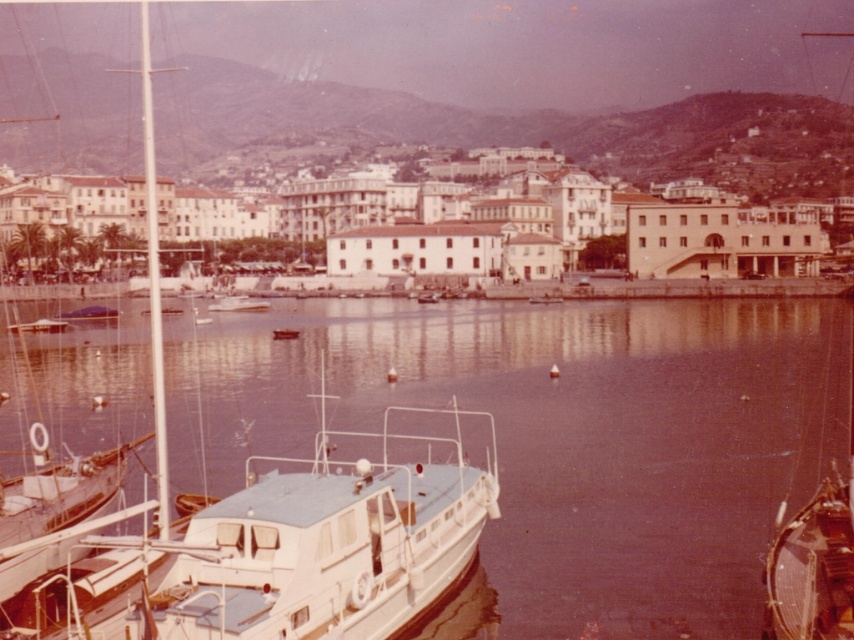
You are standing at the harbor and want to locate two specific points marked on a map. The first point is at coordinates point (154, 232) and the second is at point (793, 563). According to the scene, which point is closer to you?

Point (793, 563) is closer to you because point (154, 232) is behind it.

You are a photographer standing at the edge of the harbor. You want to capture a photo of the white glossy boat at center. If you look at the point marked at coordinates point (281, 552), will you see the white glossy boat at center there?

Yes, the point (281, 552) corresponds to the white glossy boat at center, so you will see the white glossy boat at center there.